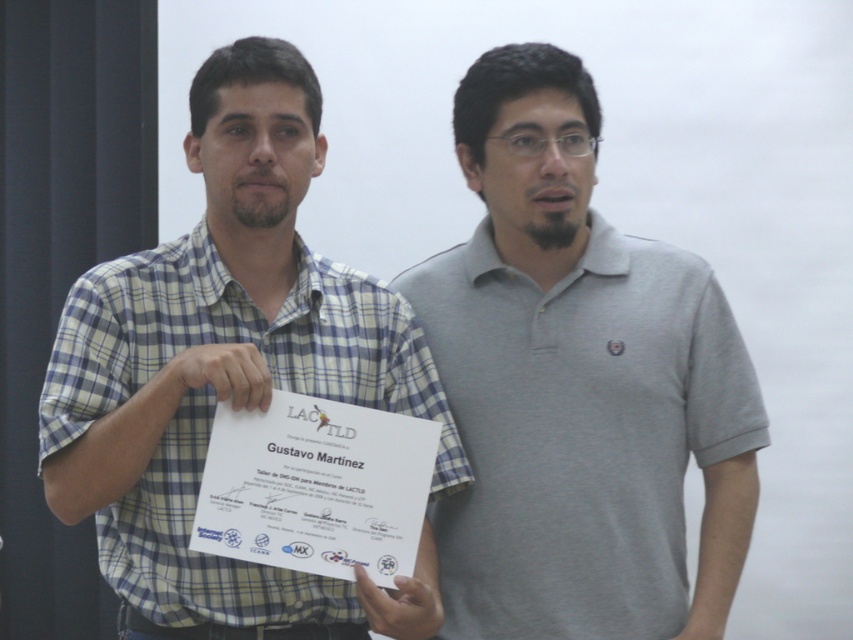
Measure the distance between point (726, 456) and camera.

2.06 meters

Is point (605, 371) closer to viewer compared to point (286, 300)?

No, it is behind (286, 300).

Find the location of a particular element. The image size is (853, 640). gray cotton polo shirt at center is located at coordinates (577, 385).

Locate an element on the screen. The image size is (853, 640). gray cotton polo shirt at center is located at coordinates (577, 385).